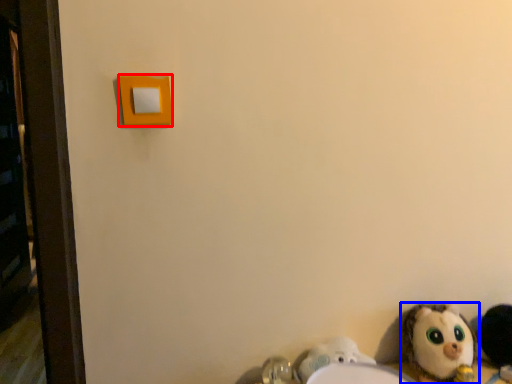
Question: Which point is closer to the camera, light switch (highlighted by a red box) or toy (highlighted by a blue box)?

Choices:
 (A) light switch
 (B) toy

Answer: (A)